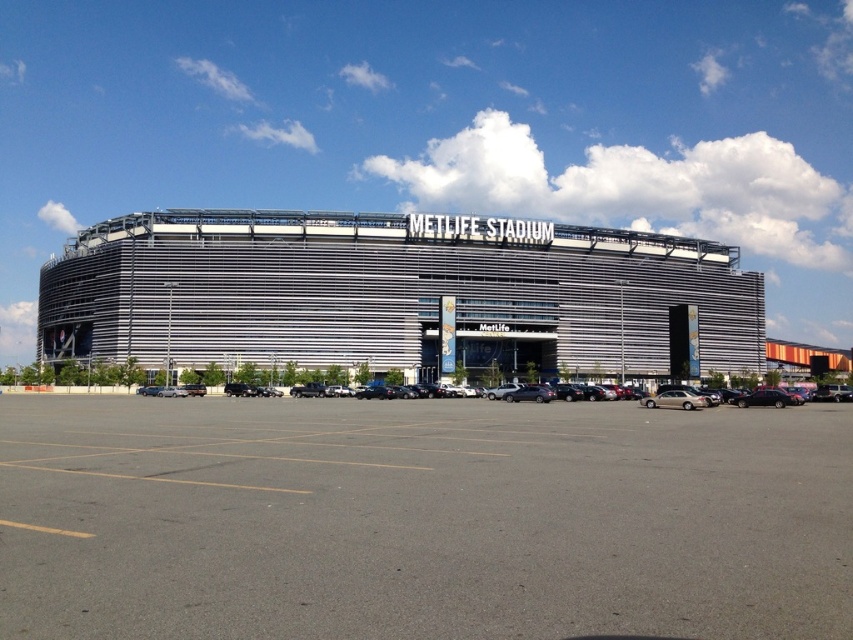
Is gray asphalt parking lot at center shorter than gold metallic sedan at center?

In fact, gray asphalt parking lot at center may be taller than gold metallic sedan at center.

In the scene shown: Which of these two, gray asphalt parking lot at center or gold metallic sedan at center, stands shorter?

gold metallic sedan at center is shorter.

This screenshot has height=640, width=853. Describe the element at coordinates (421, 518) in the screenshot. I see `gray asphalt parking lot at center` at that location.

I want to click on gray asphalt parking lot at center, so [421, 518].

What are the coordinates of `metallic silver stadium at center` in the screenshot? It's located at (399, 296).

Between metallic silver stadium at center and gold metallic sedan at center, which one appears on the left side from the viewer's perspective?

metallic silver stadium at center is more to the left.

Does point (62, 269) come farther from viewer compared to point (646, 406)?

Yes, point (62, 269) is farther from viewer.

Identify the location of metallic silver stadium at center. The height and width of the screenshot is (640, 853). (399, 296).

Can you confirm if gray asphalt parking lot at center is positioned to the left of metallic silver stadium at center?

Incorrect, gray asphalt parking lot at center is not on the left side of metallic silver stadium at center.

Does gray asphalt parking lot at center have a lesser width compared to metallic silver stadium at center?

Indeed, gray asphalt parking lot at center has a lesser width compared to metallic silver stadium at center.

The height and width of the screenshot is (640, 853). What do you see at coordinates (421, 518) in the screenshot? I see `gray asphalt parking lot at center` at bounding box center [421, 518].

This screenshot has height=640, width=853. What are the coordinates of `gray asphalt parking lot at center` in the screenshot? It's located at (421, 518).